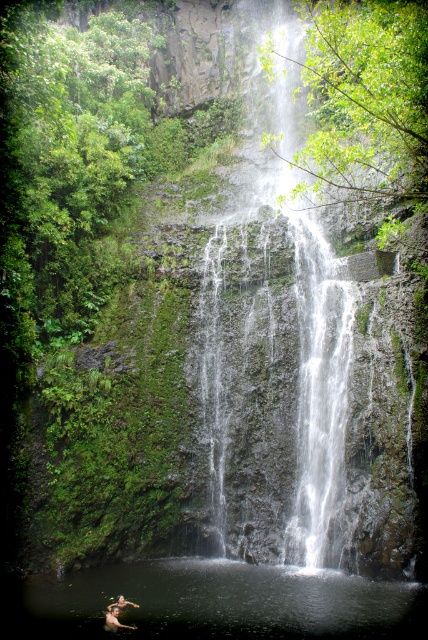
Question: Which object appears farthest from the camera in this image?

Choices:
 (A) clear water at center
 (B) white textured water at center

Answer: (B)

Question: Is skinny person at lower center above smooth skin person at lower left?

Choices:
 (A) yes
 (B) no

Answer: (A)

Question: Which object appears closest to the camera in this image?

Choices:
 (A) clear water at center
 (B) smooth skin person at lower left
 (C) skinny person at lower center

Answer: (A)

Question: Is skinny person at lower center above smooth skin person at lower left?

Choices:
 (A) no
 (B) yes

Answer: (B)

Question: Does white textured water at center have a greater width compared to skinny person at lower center?

Choices:
 (A) no
 (B) yes

Answer: (B)

Question: Which object is closer to the camera taking this photo?

Choices:
 (A) smooth skin person at lower left
 (B) white textured water at center
 (C) clear water at center

Answer: (C)